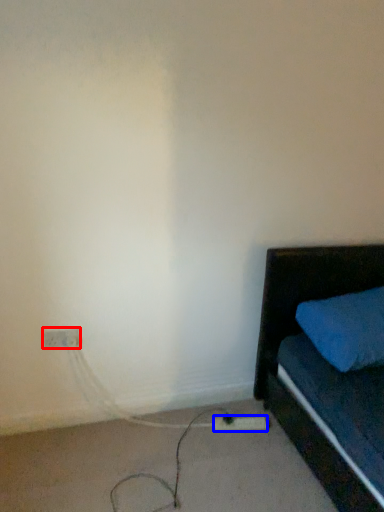
Question: Which point is further to the camera, electric outlet (highlighted by a red box) or extension cord (highlighted by a blue box)?

Choices:
 (A) electric outlet
 (B) extension cord

Answer: (B)